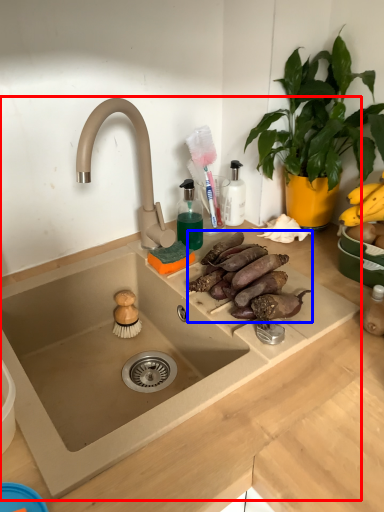
Question: Which object is closer to the camera taking this photo, sink (highlighted by a red box) or food (highlighted by a blue box)?

Choices:
 (A) sink
 (B) food

Answer: (A)